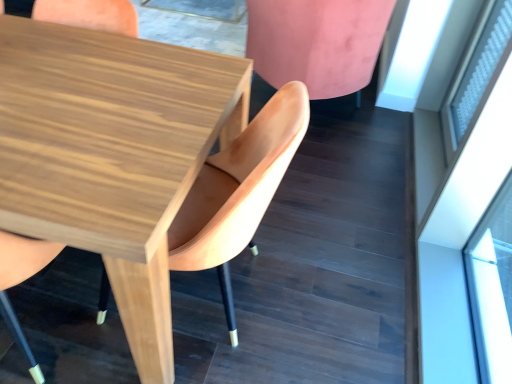
Where is `wooden chair at center, arranged as the 3th chair when viewed from the right`? The image size is (512, 384). wooden chair at center, arranged as the 3th chair when viewed from the right is located at coordinates (89, 14).

In order to face pink velvet chair at upper right, which ranks as the first chair in right-to-left order, should I rotate leftwards or rightwards?

To align with it, rotate right about 9.969°.

What is the approximate height of transparent glass door at upper right?

transparent glass door at upper right is 37.62 inches tall.

In order to face white frosted glass at upper right, should I rotate leftwards or rightwards?

To align with it, rotate right about 28.310°.

In order to click on wooden chair at center, the 2th chair from the right in this screenshot , I will do `click(238, 192)`.

Is pink velvet chair at upper right, which is the 3th chair in left-to-right order, at the back of wooden chair at center, the 2th chair from the left?

No, wooden chair at center, the 2th chair from the left,'s orientation is not away from pink velvet chair at upper right, which is the 3th chair in left-to-right order.

Between wooden chair at center, the 2th chair from the right, and pink velvet chair at upper right, which ranks as the first chair in right-to-left order, which one appears on the right side from the viewer's perspective?

pink velvet chair at upper right, which ranks as the first chair in right-to-left order, is more to the right.

From a real-world perspective, which is physically below, wooden chair at center, the 2th chair from the left, or pink velvet chair at upper right, which is the 3th chair in left-to-right order?

pink velvet chair at upper right, which is the 3th chair in left-to-right order, from a real-world perspective.

Would you consider wooden chair at center, the 2th chair from the left, to be distant from pink velvet chair at upper right, which is the 3th chair in left-to-right order?

wooden chair at center, the 2th chair from the left, is positioned a significant distance from pink velvet chair at upper right, which is the 3th chair in left-to-right order.

Who is bigger, wooden table at center or pink velvet chair at upper right, which is the 3th chair in left-to-right order?

Bigger between the two is pink velvet chair at upper right, which is the 3th chair in left-to-right order.

Which is behind, wooden table at center or pink velvet chair at upper right, which ranks as the first chair in right-to-left order?

pink velvet chair at upper right, which ranks as the first chair in right-to-left order.

Considering the points (119, 210) and (268, 59), which point is behind, point (119, 210) or point (268, 59)?

The point (268, 59) is behind.

Are wooden table at center and pink velvet chair at upper right, which ranks as the first chair in right-to-left order, making contact?

No, wooden table at center is not in contact with pink velvet chair at upper right, which ranks as the first chair in right-to-left order.

This screenshot has width=512, height=384. In order to click on chair that is the 2nd one when counting leftward from the pink velvet chair at upper right, which ranks as the first chair in right-to-left order in this screenshot , I will do `click(89, 14)`.

Between wooden chair at center, the first chair positioned from the left, and pink velvet chair at upper right, which ranks as the first chair in right-to-left order, which one appears on the right side from the viewer's perspective?

pink velvet chair at upper right, which ranks as the first chair in right-to-left order, is more to the right.

Considering the sizes of wooden chair at center, the first chair positioned from the left, and pink velvet chair at upper right, which ranks as the first chair in right-to-left order, in the image, is wooden chair at center, the first chair positioned from the left, taller or shorter than pink velvet chair at upper right, which ranks as the first chair in right-to-left order,?

wooden chair at center, the first chair positioned from the left, is taller than pink velvet chair at upper right, which ranks as the first chair in right-to-left order.

From the picture: Could you tell me if transparent glass door at upper right is turned towards wooden table at center?

Yes, transparent glass door at upper right is oriented towards wooden table at center.

From the picture: Considering the relative positions of transparent glass door at upper right and wooden table at center in the image provided, is transparent glass door at upper right in front of wooden table at center?

No.

Considering the sizes of objects transparent glass door at upper right and wooden table at center in the image provided, who is shorter, transparent glass door at upper right or wooden table at center?

Standing shorter between the two is wooden table at center.

Considering the sizes of transparent glass door at upper right and wooden table at center in the image, is transparent glass door at upper right wider or thinner than wooden table at center?

Considering their sizes, transparent glass door at upper right looks slimmer than wooden table at center.

In the scene shown: Considering the sizes of objects white frosted glass at upper right and wooden chair at center, the first chair positioned from the left, in the image provided, who is shorter, white frosted glass at upper right or wooden chair at center, the first chair positioned from the left,?

white frosted glass at upper right.

From the image's perspective, which is above, white frosted glass at upper right or wooden chair at center, arranged as the 3th chair when viewed from the right?

white frosted glass at upper right.

Can you confirm if white frosted glass at upper right is positioned to the left of wooden chair at center, the first chair positioned from the left?

Incorrect, white frosted glass at upper right is not on the left side of wooden chair at center, the first chair positioned from the left.

Can you confirm if wooden chair at center, the first chair positioned from the left, is smaller than wooden chair at center, the 2th chair from the left?

Yes.

How much distance is there between wooden chair at center, arranged as the 3th chair when viewed from the right, and wooden chair at center, the 2th chair from the right?

wooden chair at center, arranged as the 3th chair when viewed from the right, and wooden chair at center, the 2th chair from the right, are 20.79 inches apart.

Does point (102, 29) appear closer or farther from the camera than point (258, 126)?

Point (102, 29) is positioned farther from the camera compared to point (258, 126).

Is wooden chair at center, arranged as the 3th chair when viewed from the right, looking in the opposite direction of wooden table at center?

wooden chair at center, arranged as the 3th chair when viewed from the right, does not have its back to wooden table at center.

How many degrees apart are the facing directions of wooden chair at center, the first chair positioned from the left, and wooden table at center?

The facing directions of wooden chair at center, the first chair positioned from the left, and wooden table at center are 178 degrees apart.

Would you say wooden table at center is part of wooden chair at center, arranged as the 3th chair when viewed from the right,'s contents?

No, wooden table at center is not surrounded by wooden chair at center, arranged as the 3th chair when viewed from the right.

Which object is positioned more to the right, wooden chair at center, arranged as the 3th chair when viewed from the right, or wooden table at center?

wooden table at center is more to the right.

From the pink velvet chair at upper right, which ranks as the first chair in right-to-left order, count 1st chairs forward and point to it. Please provide its 2D coordinates.

[(238, 192)]

Identify the location of the 2nd chair below the wooden table at center (from a real-world perspective). The width and height of the screenshot is (512, 384). (317, 43).

Considering their positions, is pink velvet chair at upper right, which is the 3th chair in left-to-right order, positioned further to transparent glass door at upper right than wooden chair at center, the 2th chair from the left?

Based on the image, wooden chair at center, the 2th chair from the left, appears to be further to transparent glass door at upper right.

Looking at the image, which one is located further to transparent glass door at upper right, wooden table at center or wooden chair at center, arranged as the 3th chair when viewed from the right?

wooden chair at center, arranged as the 3th chair when viewed from the right.

Based on their spatial positions, is transparent glass door at upper right or white frosted glass at upper right further from wooden table at center?

Among the two, white frosted glass at upper right is located further to wooden table at center.

Based on their spatial positions, is wooden chair at center, arranged as the 3th chair when viewed from the right, or wooden table at center closer to pink velvet chair at upper right, which ranks as the first chair in right-to-left order?

Based on the image, wooden table at center appears to be nearer to pink velvet chair at upper right, which ranks as the first chair in right-to-left order.

In the scene shown: When comparing their distances from pink velvet chair at upper right, which is the 3th chair in left-to-right order, does wooden chair at center, the 2th chair from the left, or transparent glass door at upper right seem further?

The object further to pink velvet chair at upper right, which is the 3th chair in left-to-right order, is wooden chair at center, the 2th chair from the left.

Estimate the real-world distances between objects in this image. Which object is closer to transparent glass door at upper right, wooden chair at center, arranged as the 3th chair when viewed from the right, or white frosted glass at upper right?

Based on the image, white frosted glass at upper right appears to be nearer to transparent glass door at upper right.

When comparing their distances from transparent glass door at upper right, does wooden chair at center, arranged as the 3th chair when viewed from the right, or wooden table at center seem further?

wooden chair at center, arranged as the 3th chair when viewed from the right, is further to transparent glass door at upper right.

Considering their positions, is white frosted glass at upper right positioned further to wooden table at center than transparent glass door at upper right?

The object further to wooden table at center is white frosted glass at upper right.

The image size is (512, 384). Find the location of `round table between wooden chair at center, arranged as the 3th chair when viewed from the right, and white frosted glass at upper right, in the horizontal direction`. round table between wooden chair at center, arranged as the 3th chair when viewed from the right, and white frosted glass at upper right, in the horizontal direction is located at coordinates (106, 132).

Where is `chair situated between wooden table at center and pink velvet chair at upper right, which is the 3th chair in left-to-right order, from left to right`? The image size is (512, 384). chair situated between wooden table at center and pink velvet chair at upper right, which is the 3th chair in left-to-right order, from left to right is located at coordinates (238, 192).

This screenshot has height=384, width=512. What are the coordinates of `glass door situated between wooden chair at center, the 2th chair from the left, and white frosted glass at upper right from left to right` in the screenshot? It's located at (468, 213).

Locate an element on the screen. This screenshot has width=512, height=384. round table between wooden chair at center, the first chair positioned from the left, and pink velvet chair at upper right, which ranks as the first chair in right-to-left order, in the horizontal direction is located at coordinates (106, 132).